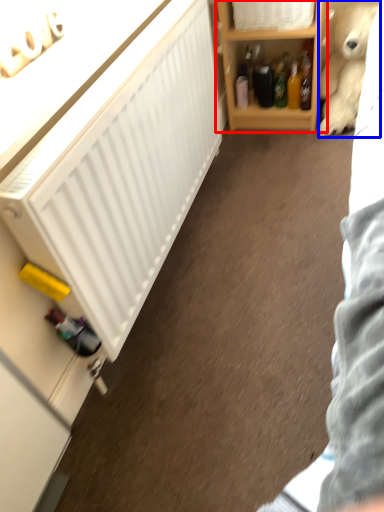
Question: Which point is further to the camera, shelf (highlighted by a red box) or teddy bear (highlighted by a blue box)?

Choices:
 (A) shelf
 (B) teddy bear

Answer: (B)